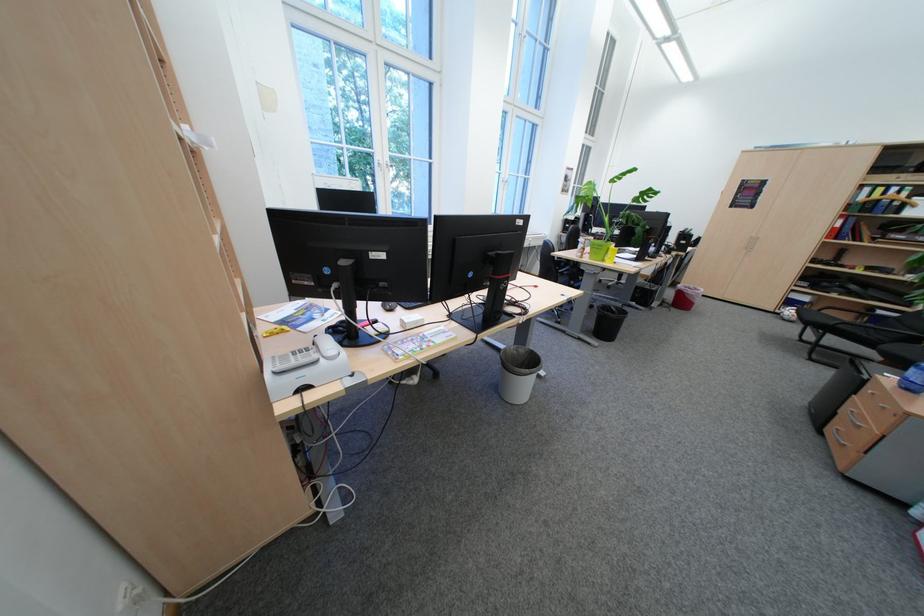
Identify the location of white telephone handset. This screenshot has height=616, width=924. (326, 346).